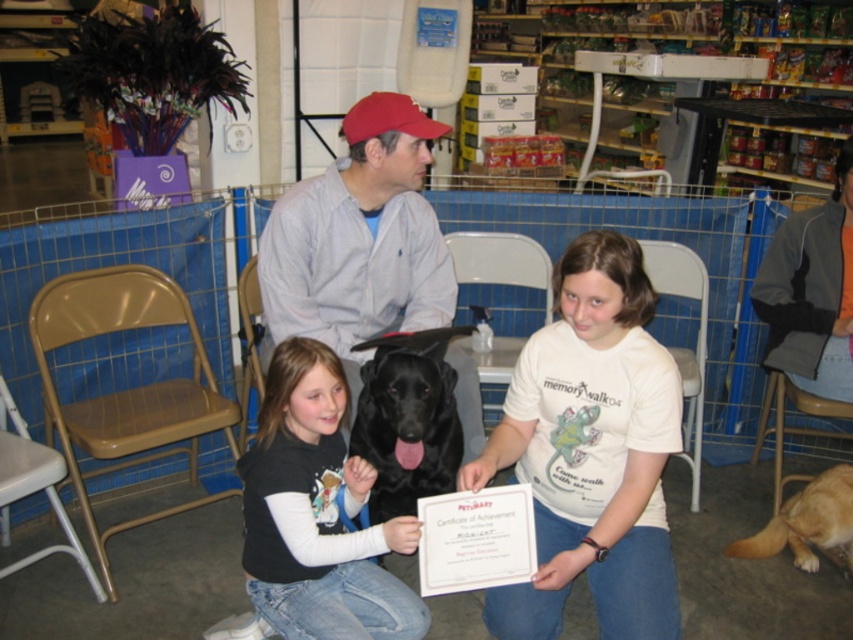
Question: Can you confirm if white cotton shirt at center is thinner than black matte dog at center?

Choices:
 (A) no
 (B) yes

Answer: (A)

Question: Is white cotton shirt at center below orange fleece jacket at upper right?

Choices:
 (A) yes
 (B) no

Answer: (A)

Question: Which object appears farthest from the camera in this image?

Choices:
 (A) gray fleece jacket at center
 (B) black matte shirt at center
 (C) black matte dog at center

Answer: (A)

Question: Among these points, which one is farthest from the camera?

Choices:
 (A) (834, 221)
 (B) (384, 328)
 (C) (248, 538)
 (D) (364, 419)

Answer: (A)

Question: Which is nearer to the golden fur dog at lower right?

Choices:
 (A) black matte dog at center
 (B) white cotton shirt at center
 (C) orange fleece jacket at upper right
 (D) gray fleece jacket at center

Answer: (C)

Question: Does white cotton shirt at center have a larger size compared to black matte dog at center?

Choices:
 (A) yes
 (B) no

Answer: (A)